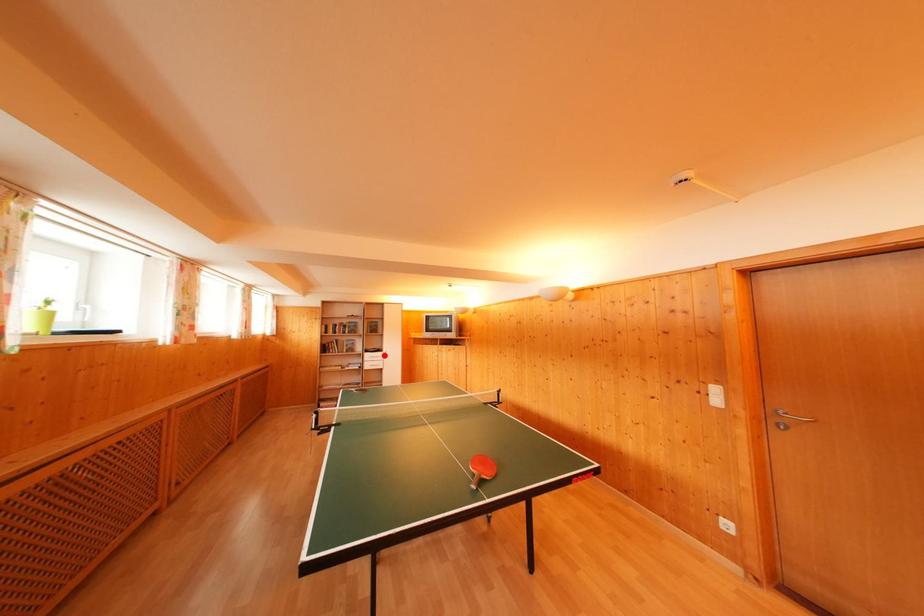
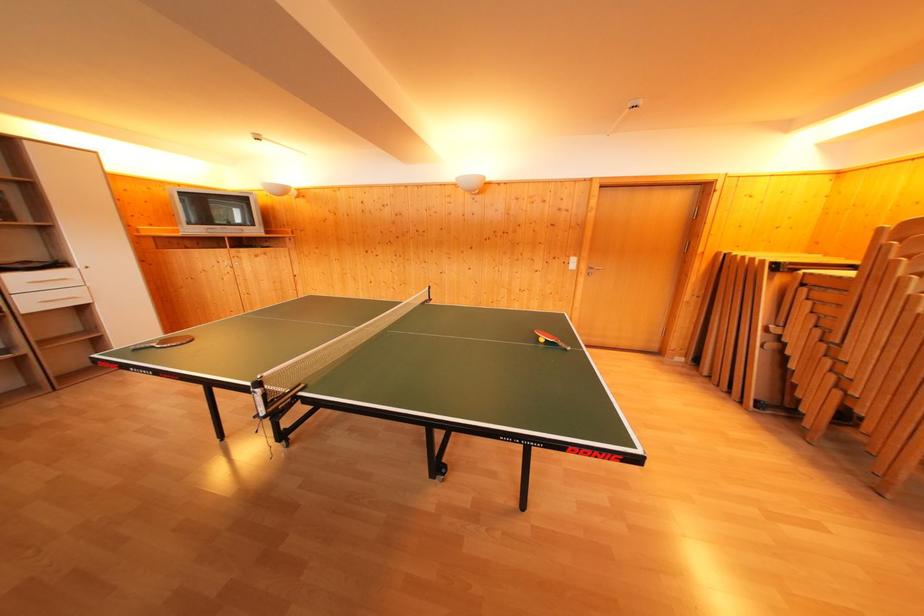
Question: I am providing you with two images of the same scene from different viewpoints. A red point is shown in image1. For the corresponding object point in image2, is it positioned nearer or farther from the camera?

Choices:
 (A) Nearer
 (B) Farther

Answer: (B)